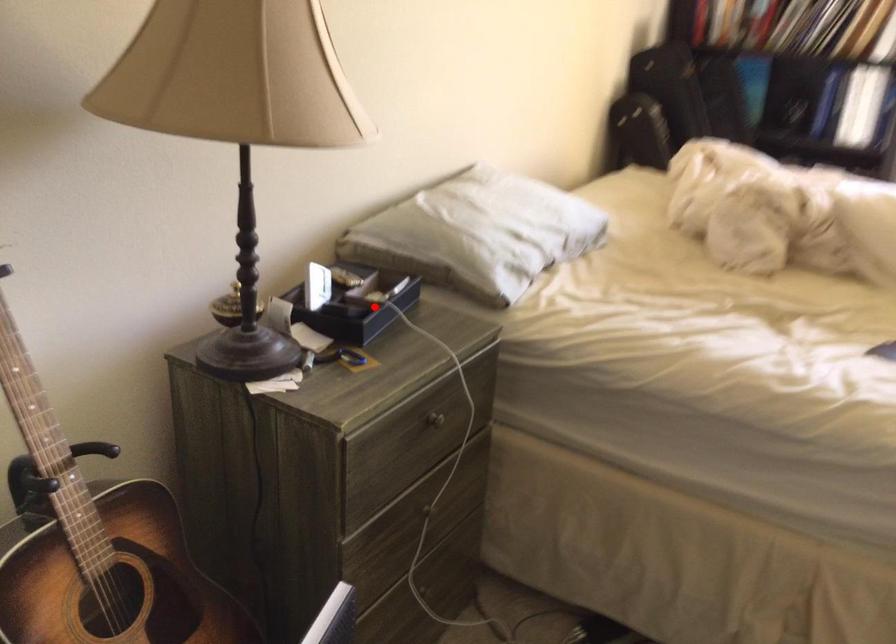
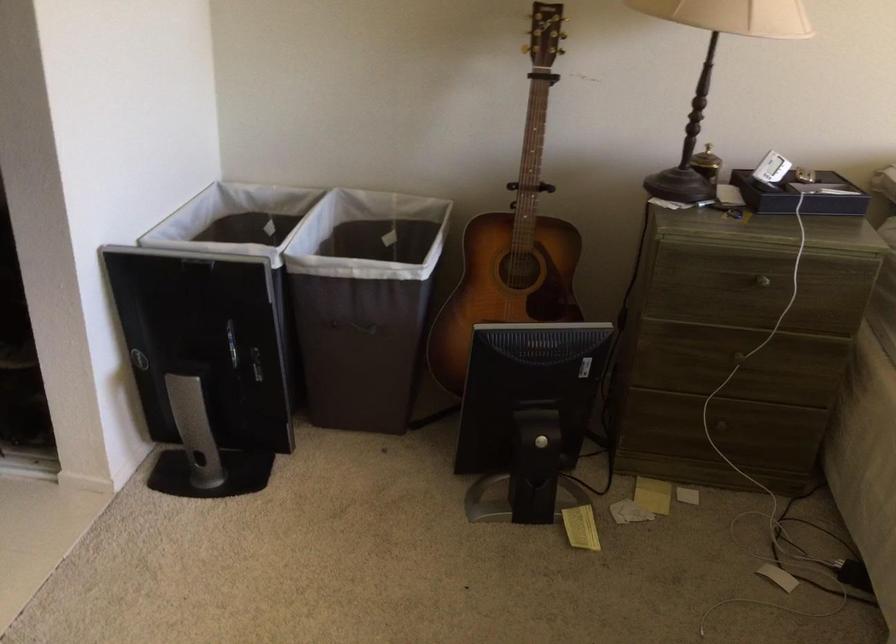
Locate, in the second image, the point that corresponds to the highlighted location in the first image.

(800, 194)